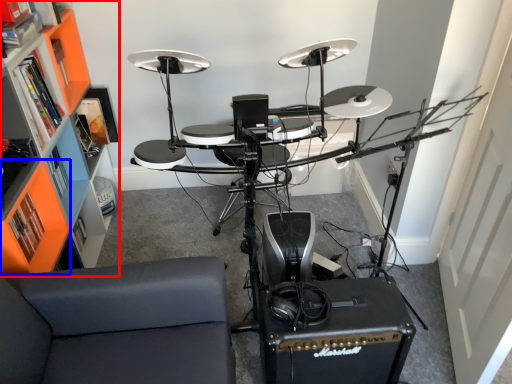
Question: Among these objects, which one is farthest to the camera, bookshelf (highlighted by a red box) or shelf (highlighted by a blue box)?

Choices:
 (A) bookshelf
 (B) shelf

Answer: (B)